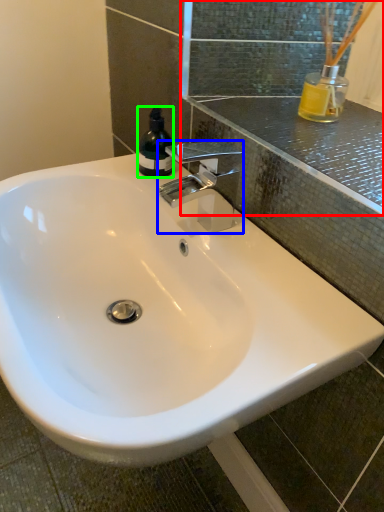
Question: Which object is positioned farthest from mirror (highlighted by a red box)? Select from tap (highlighted by a blue box) and bottle (highlighted by a green box).

Choices:
 (A) tap
 (B) bottle

Answer: (B)